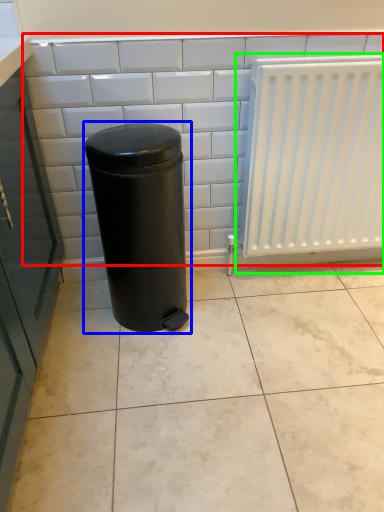
Question: Which object is the farthest from ceramic tile (highlighted by a red box)? Choose among these: waste container (highlighted by a blue box) or radiator (highlighted by a green box).

Choices:
 (A) waste container
 (B) radiator

Answer: (B)